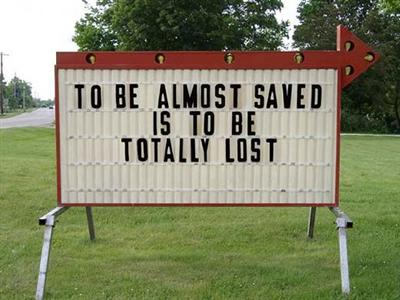
Where is `sign frame`? The height and width of the screenshot is (300, 400). sign frame is located at coordinates coord(339,214), coord(58,211).